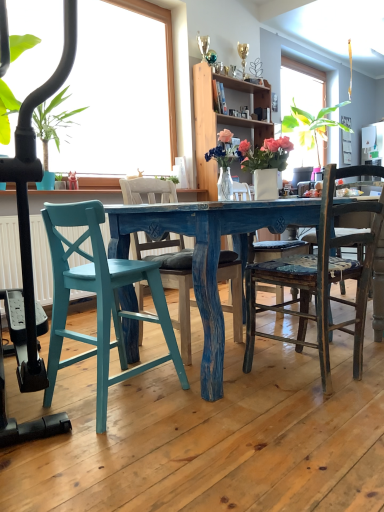
Question: Is teal painted wood chair at lower left, which ranks as the third chair in right-to-left order, wider than wooden cabinet at upper center?

Choices:
 (A) no
 (B) yes

Answer: (B)

Question: Can you confirm if teal painted wood chair at lower left, which ranks as the third chair in right-to-left order, is taller than wooden cabinet at upper center?

Choices:
 (A) no
 (B) yes

Answer: (A)

Question: Is teal painted wood chair at lower left, which ranks as the third chair in right-to-left order, at the left side of wooden cabinet at upper center?

Choices:
 (A) no
 (B) yes

Answer: (B)

Question: From a real-world perspective, is teal painted wood chair at lower left, which ranks as the third chair in right-to-left order, below wooden cabinet at upper center?

Choices:
 (A) yes
 (B) no

Answer: (A)

Question: Does teal painted wood chair at lower left, which ranks as the third chair in right-to-left order, lie in front of wooden cabinet at upper center?

Choices:
 (A) no
 (B) yes

Answer: (B)

Question: Considering their positions, is white glossy vase at center located in front of or behind teal painted wood chair at lower left, which ranks as the third chair in right-to-left order?

Choices:
 (A) behind
 (B) front

Answer: (A)

Question: Is point (284, 152) positioned closer to the camera than point (104, 391)?

Choices:
 (A) closer
 (B) farther

Answer: (B)

Question: Looking at their shapes, would you say white glossy vase at center is wider or thinner than teal painted wood chair at lower left, which ranks as the third chair in right-to-left order?

Choices:
 (A) wide
 (B) thin

Answer: (B)

Question: Considering the positions of white glossy vase at center and teal painted wood chair at lower left, which ranks as the third chair in right-to-left order, in the image, is white glossy vase at center taller or shorter than teal painted wood chair at lower left, which ranks as the third chair in right-to-left order,?

Choices:
 (A) tall
 (B) short

Answer: (B)

Question: In terms of width, does green leafy plant at left look wider or thinner when compared to distressed wood chair at center, which is the 1th chair in right-to-left order?

Choices:
 (A) thin
 (B) wide

Answer: (A)

Question: In the image, is green leafy plant at left on the left side or the right side of distressed wood chair at center, which is the 1th chair in right-to-left order?

Choices:
 (A) right
 (B) left

Answer: (B)

Question: From a real-world perspective, is green leafy plant at left above or below distressed wood chair at center, which is the 3th chair in left-to-right order?

Choices:
 (A) below
 (B) above

Answer: (B)

Question: Is green leafy plant at left taller or shorter than distressed wood chair at center, which is the 1th chair in right-to-left order?

Choices:
 (A) tall
 (B) short

Answer: (A)

Question: In terms of height, does wooden cabinet at upper center look taller or shorter compared to distressed wood chair at center, which is the 3th chair in left-to-right order?

Choices:
 (A) tall
 (B) short

Answer: (A)

Question: From a real-world perspective, is wooden cabinet at upper center positioned above or below distressed wood chair at center, which is the 1th chair in right-to-left order?

Choices:
 (A) below
 (B) above

Answer: (B)